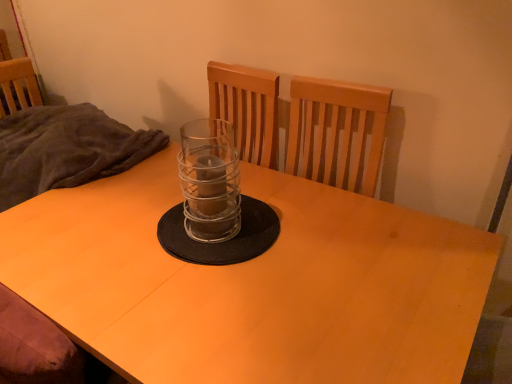
This screenshot has width=512, height=384. What are the coordinates of `clear glass candle holder at center` in the screenshot? It's located at (x=214, y=202).

What do you see at coordinates (253, 284) in the screenshot? This screenshot has width=512, height=384. I see `matte wood desk at center` at bounding box center [253, 284].

The image size is (512, 384). Find the location of `clear glass candle holder at center`. clear glass candle holder at center is located at coordinates (214, 202).

I want to click on desk in front of the clear glass candle holder at center, so [x=253, y=284].

Considering the sizes of objects clear glass candle holder at center and matte wood desk at center in the image provided, who is wider, clear glass candle holder at center or matte wood desk at center?

matte wood desk at center is wider.

Considering the relative positions of clear glass candle holder at center and matte wood desk at center in the image provided, is clear glass candle holder at center to the left of matte wood desk at center from the viewer's perspective?

Correct, you'll find clear glass candle holder at center to the left of matte wood desk at center.

Is clear glass candle holder at center positioned with its back to matte wood desk at center?

That's not correct — clear glass candle holder at center is not looking away from matte wood desk at center.

From their relative heights in the image, would you say dark gray fabric at left is taller or shorter than matte wood desk at center?

In the image, dark gray fabric at left appears to be shorter than matte wood desk at center.

This screenshot has height=384, width=512. I want to click on blanket above the matte wood desk at center (from the image's perspective), so click(x=66, y=149).

From a real-world perspective, who is located lower, dark gray fabric at left or matte wood desk at center?

In real-world perspective, matte wood desk at center is lower.

Does dark gray fabric at left have a lesser width compared to matte wood desk at center?

Correct, the width of dark gray fabric at left is less than that of matte wood desk at center.

Does matte wood desk at center have a greater width compared to dark gray fabric at left?

Indeed, matte wood desk at center has a greater width compared to dark gray fabric at left.

Is point (308, 360) closer to camera compared to point (46, 116)?

Yes.

Who is smaller, matte wood desk at center or dark gray fabric at left?

With smaller size is dark gray fabric at left.

Locate an element on the screen. Image resolution: width=512 pixels, height=384 pixels. desk lying in front of the dark gray fabric at left is located at coordinates (253, 284).

Is matte wood desk at center bigger than clear glass candle holder at center?

Yes, matte wood desk at center is bigger than clear glass candle holder at center.

From the image's perspective, is matte wood desk at center on top of clear glass candle holder at center?

Actually, matte wood desk at center appears below clear glass candle holder at center in the image.

Which object is positioned more to the right, matte wood desk at center or clear glass candle holder at center?

From the viewer's perspective, matte wood desk at center appears more on the right side.

Is dark gray fabric at left positioned with its back to clear glass candle holder at center?

No.

From the image's perspective, is dark gray fabric at left on clear glass candle holder at center?

Yes, from the image's perspective, dark gray fabric at left is over clear glass candle holder at center.

In the scene shown: Is clear glass candle holder at center positioned with its back to dark gray fabric at left?

That's not correct — clear glass candle holder at center is not looking away from dark gray fabric at left.

Could dark gray fabric at left be considered to be inside clear glass candle holder at center?

No, dark gray fabric at left is not surrounded by clear glass candle holder at center.

Which is less distant, (220, 163) or (15, 200)?

The point (220, 163) is closer.

From a real-world perspective, is clear glass candle holder at center physically below dark gray fabric at left?

No, from a real-world perspective, clear glass candle holder at center is not beneath dark gray fabric at left.

In the image, there is a clear glass candle holder at center. Where is `desk below it (from a real-world perspective)`? desk below it (from a real-world perspective) is located at coordinates (253, 284).

In the image, there is a matte wood desk at center. Where is `blanket above it (from the image's perspective)`? The height and width of the screenshot is (384, 512). blanket above it (from the image's perspective) is located at coordinates (66, 149).

Looking at the image, which one is located closer to dark gray fabric at left, clear glass candle holder at center or matte wood desk at center?

matte wood desk at center is closer to dark gray fabric at left.

In the scene shown: When comparing their distances from matte wood desk at center, does clear glass candle holder at center or dark gray fabric at left seem closer?

Among the two, clear glass candle holder at center is located nearer to matte wood desk at center.

Looking at this image, from the image, which object appears to be nearer to clear glass candle holder at center, dark gray fabric at left or matte wood desk at center?

The object closer to clear glass candle holder at center is matte wood desk at center.

Based on the photo, when comparing their distances from clear glass candle holder at center, does matte wood desk at center or dark gray fabric at left seem closer?

The object closer to clear glass candle holder at center is matte wood desk at center.

Considering their positions, is dark gray fabric at left positioned further to matte wood desk at center than clear glass candle holder at center?

dark gray fabric at left is further to matte wood desk at center.

Considering their positions, is matte wood desk at center positioned closer to dark gray fabric at left than clear glass candle holder at center?

Based on the image, matte wood desk at center appears to be nearer to dark gray fabric at left.

Where is `candle holder between dark gray fabric at left and matte wood desk at center in the horizontal direction`? candle holder between dark gray fabric at left and matte wood desk at center in the horizontal direction is located at coordinates (x=214, y=202).